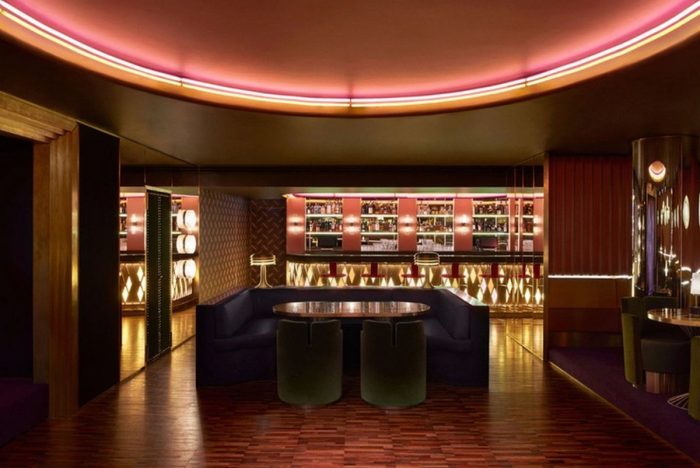
Locate an element on the screen. This screenshot has height=468, width=700. mirrored glass doors is located at coordinates (131, 265), (192, 238).